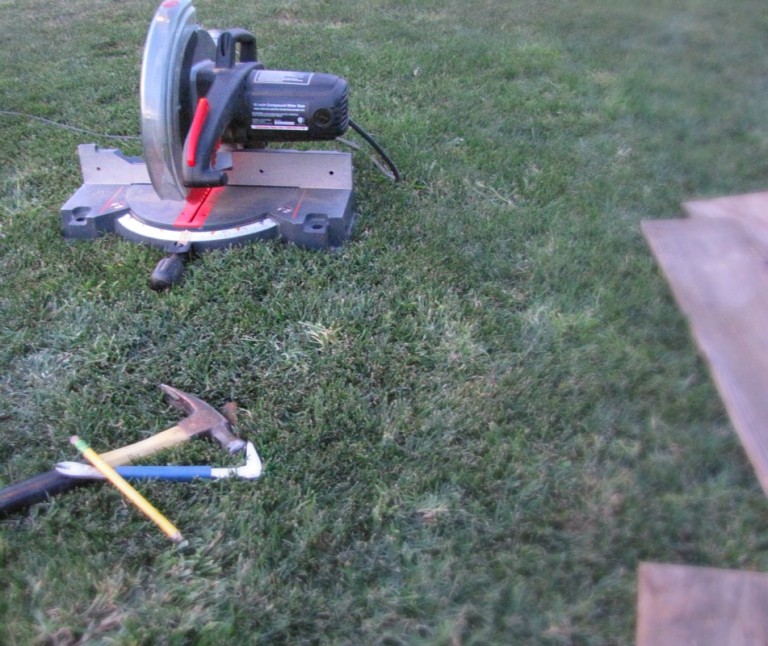
This screenshot has height=646, width=768. Find the location of `safety switch`. safety switch is located at coordinates (197, 110).